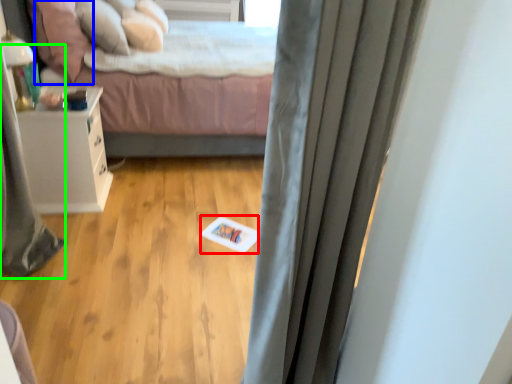
Question: Considering the real-world distances, which object is farthest from card (highlighted by a red box)? pillow (highlighted by a blue box) or shower curtain (highlighted by a green box)?

Choices:
 (A) pillow
 (B) shower curtain

Answer: (A)